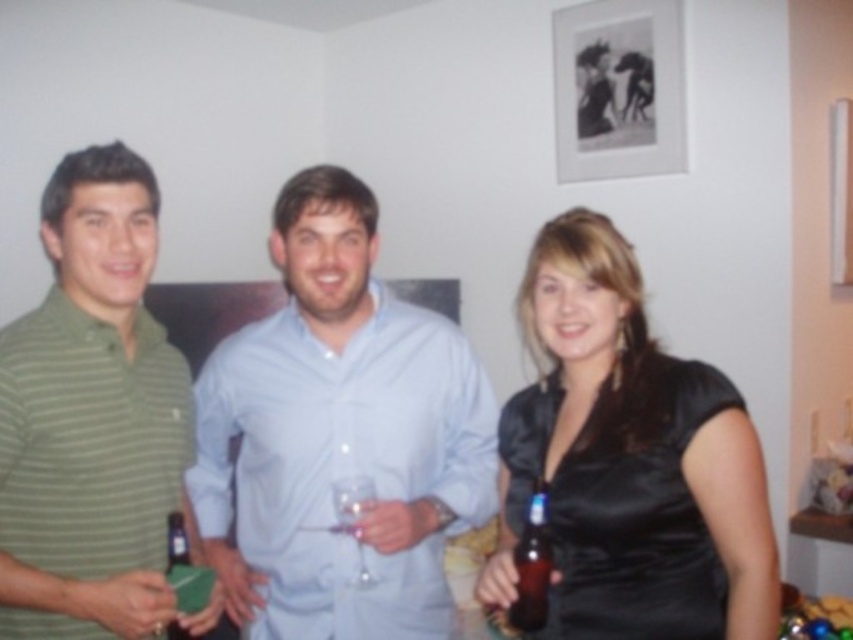
You are standing at the origin point in the image. Which of the two points, point (x=103, y=372) or point (x=610, y=20), is closer to you?

Point (x=103, y=372) is closer to you because it is in front of point (x=610, y=20).

You are organizing a party and need to place the black paper at upper center and the translucent glass beer bottle at lower right on a shelf. If the shelf can only hold items up to 15 cm in height, which item might not fit?

The black paper at upper center is bigger than the translucent glass beer bottle at lower right, so the black paper at upper center might not fit on the shelf if it exceeds the 15 cm height limit.

You are at a party and need to find the green striped polo shirt at left. Where should you look relative to the black paper at upper center?

The green striped polo shirt at left is located below the black paper at upper center, so look downward from the black paper at upper center to find it.